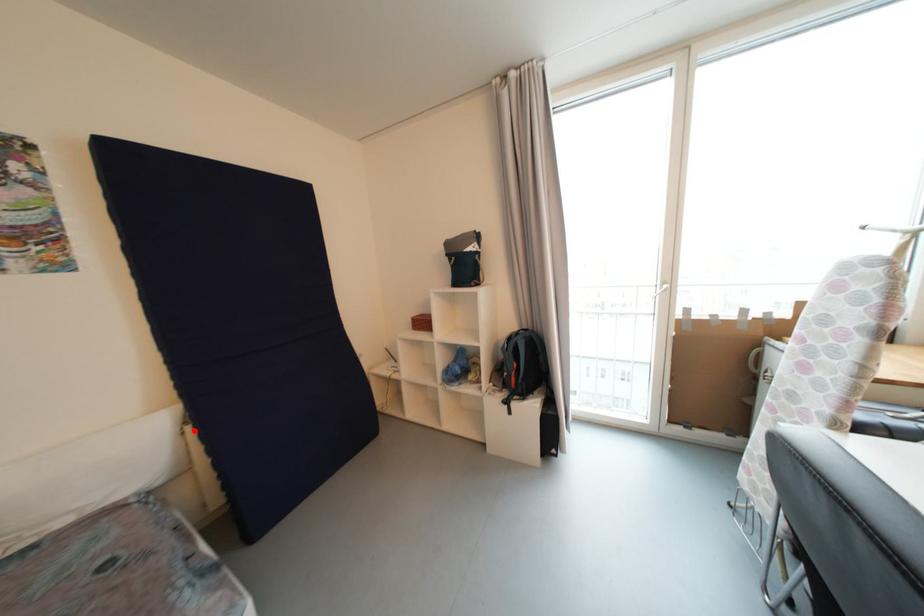
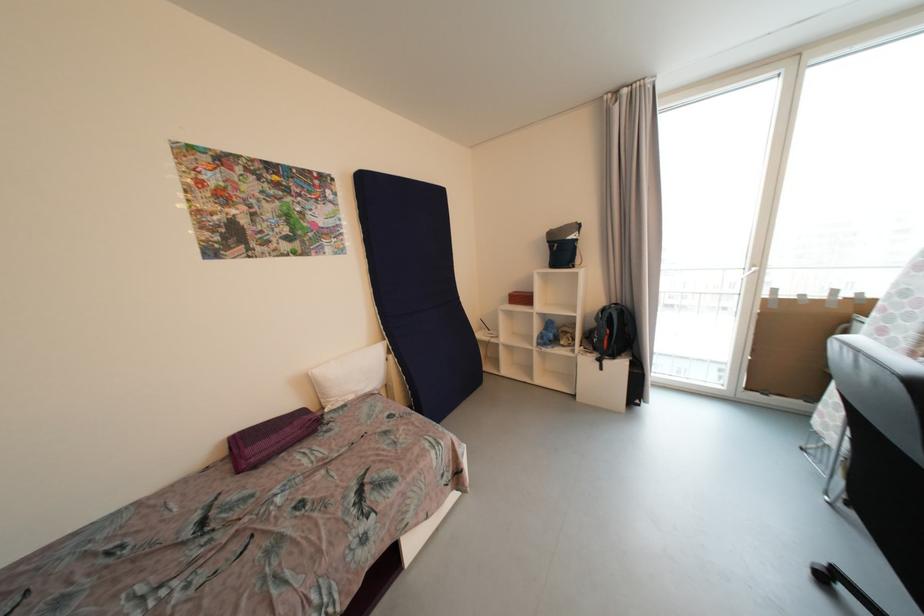
In the second image, find the point that corresponds to the highlighted location in the first image.

(396, 359)